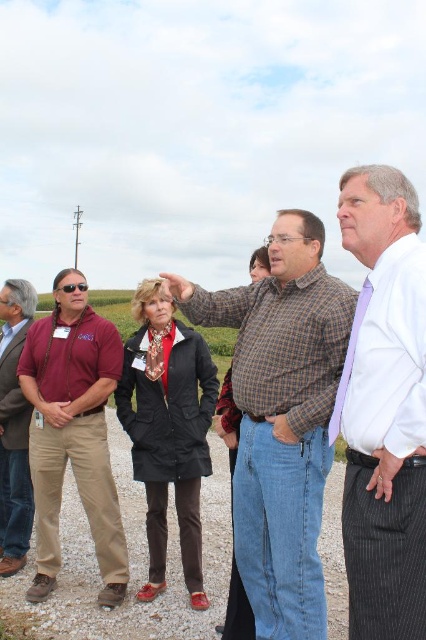
Question: Does brown checkered shirt at center have a smaller size compared to matte maroon shirt at left?

Choices:
 (A) yes
 (B) no

Answer: (B)

Question: Which object is the farthest from the brown checkered shirt at center?

Choices:
 (A) white striped shirt at center
 (B) matte maroon shirt at left
 (C) matte brown jacket at left

Answer: (C)

Question: Considering the relative positions of brown checkered shirt at center and matte brown jacket at left in the image provided, where is brown checkered shirt at center located with respect to matte brown jacket at left?

Choices:
 (A) below
 (B) above

Answer: (A)

Question: Considering the real-world distances, which object is farthest from the matte brown jacket at left?

Choices:
 (A) brown checkered shirt at center
 (B) matte maroon shirt at left
 (C) white striped shirt at center

Answer: (C)

Question: Does white striped shirt at center have a smaller size compared to matte brown jacket at left?

Choices:
 (A) no
 (B) yes

Answer: (A)

Question: Considering the real-world distances, which object is closest to the matte brown jacket at left?

Choices:
 (A) matte maroon shirt at left
 (B) white striped shirt at center

Answer: (A)